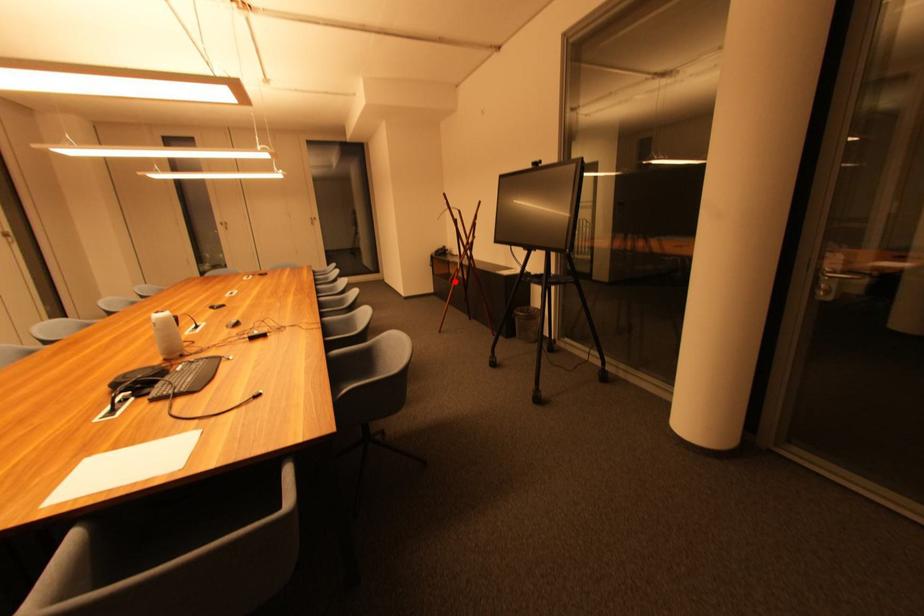
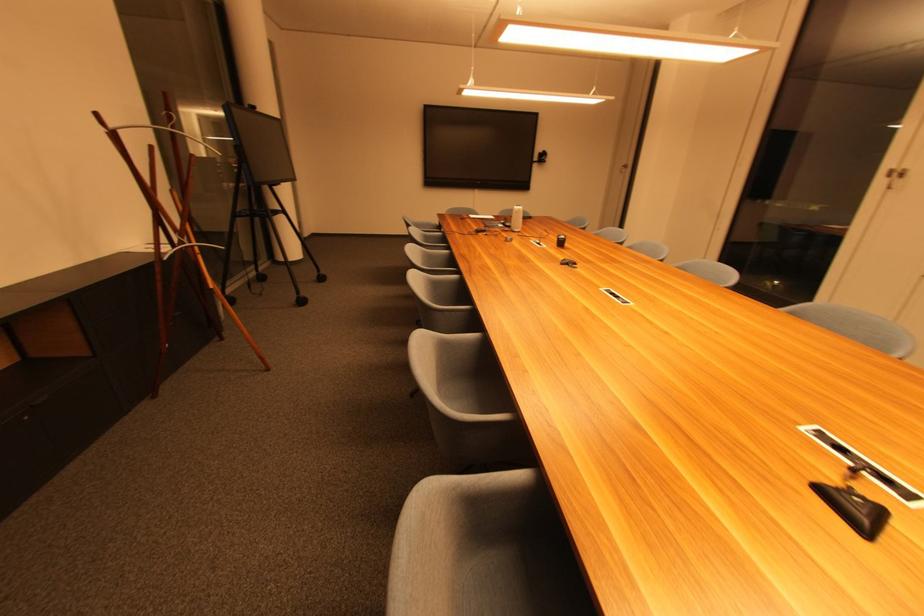
In the second image, find the point that corresponds to the highlighted location in the first image.

(216, 288)